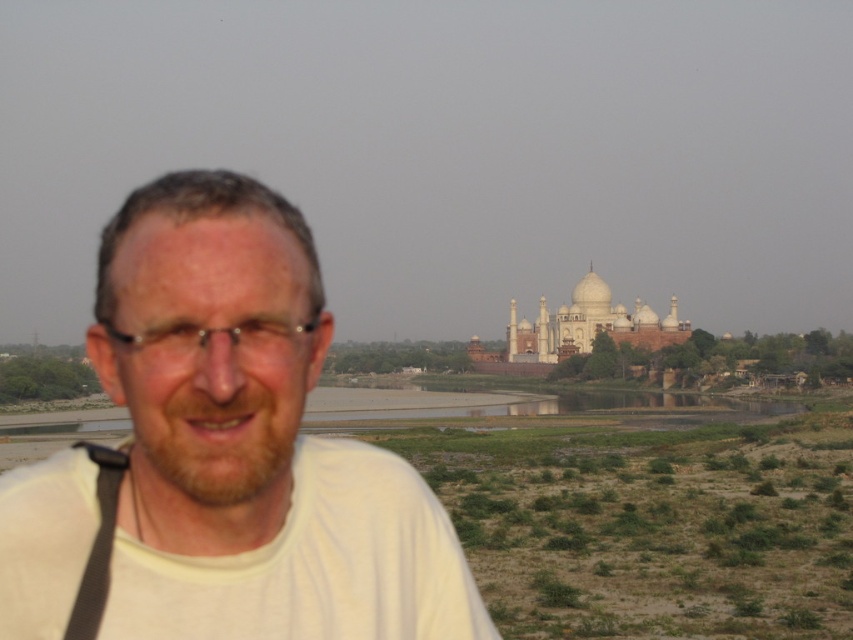
Question: Can you confirm if white matte shirt at left is wider than white marble palace at center?

Choices:
 (A) no
 (B) yes

Answer: (B)

Question: Which object is the farthest from the white matte shirt at left?

Choices:
 (A) white marble palace at center
 (B) black fabric strap at lower left

Answer: (A)

Question: Which point is closer to the camera taking this photo?

Choices:
 (A) (619, 340)
 (B) (177, 605)
 (C) (111, 474)

Answer: (B)

Question: Is white marble palace at center positioned at the back of black fabric strap at lower left?

Choices:
 (A) no
 (B) yes

Answer: (B)

Question: Which object appears farthest from the camera in this image?

Choices:
 (A) black fabric strap at lower left
 (B) white matte shirt at left
 (C) white marble palace at center

Answer: (C)

Question: Can you confirm if white matte shirt at left is smaller than white marble palace at center?

Choices:
 (A) yes
 (B) no

Answer: (B)